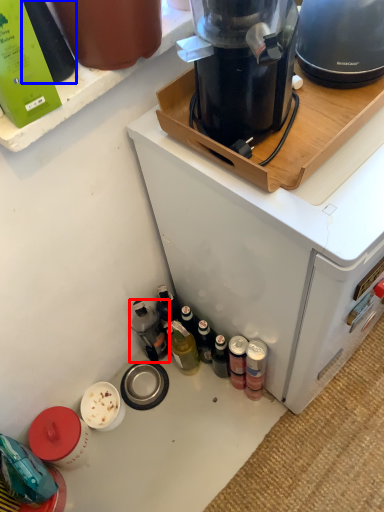
Question: Which point is closer to the camera, bottle (highlighted by a red box) or bottle (highlighted by a blue box)?

Choices:
 (A) bottle
 (B) bottle

Answer: (B)